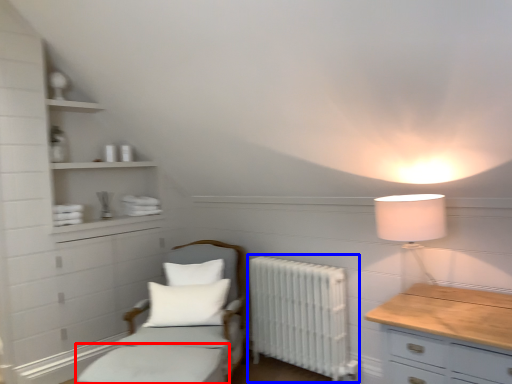
Question: Which point is closer to the camera, bed frame (highlighted by a red box) or radiator (highlighted by a blue box)?

Choices:
 (A) bed frame
 (B) radiator

Answer: (A)